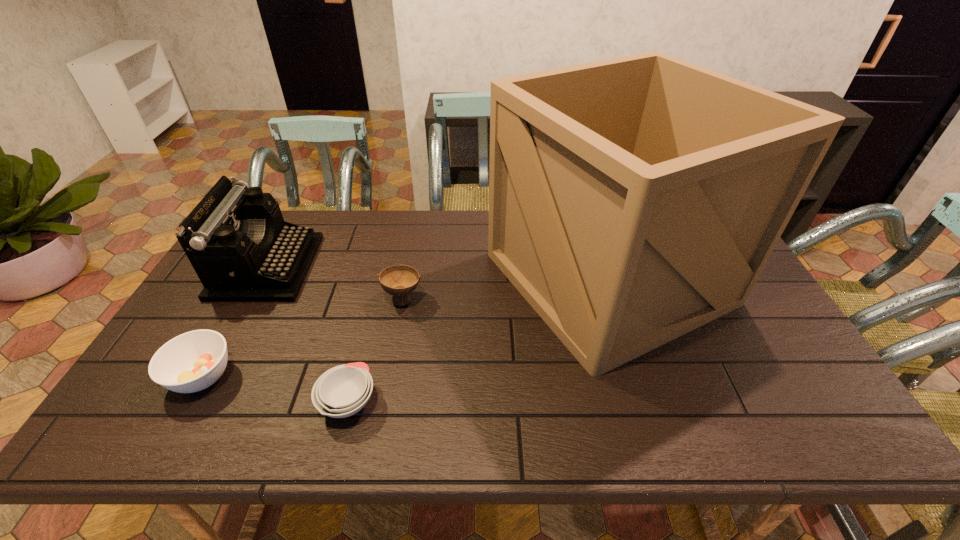
Identify the location of the tallest object. (632, 200).

Locate an element on the screen. The width and height of the screenshot is (960, 540). box is located at coordinates (632, 200).

In order to click on typewriter in this screenshot , I will do `click(242, 250)`.

At what (x,y) coordinates should I click in order to perform the action: click on the third tallest object. Please return your answer as a coordinate pair (x, y). The image size is (960, 540). Looking at the image, I should click on (399, 280).

In order to click on the farthest soup bowl in this screenshot , I will do `click(399, 280)`.

This screenshot has width=960, height=540. I want to click on the second tallest soup bowl, so click(193, 361).

This screenshot has width=960, height=540. Identify the location of the leftmost soup bowl. (193, 361).

Where is `the shortest soup bowl`? the shortest soup bowl is located at coordinates (342, 391).

I want to click on blank area located on the front of the tallest object, so click(x=656, y=426).

Locate an element on the screen. The width and height of the screenshot is (960, 540). free region located 0.230m on the typing side of the typewriter is located at coordinates (383, 267).